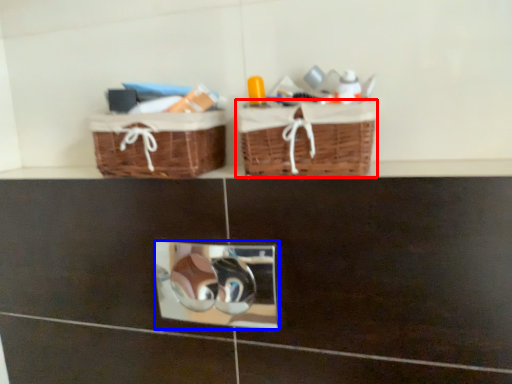
Question: Which point is further to the camera, picnic basket (highlighted by a red box) or mirror (highlighted by a blue box)?

Choices:
 (A) picnic basket
 (B) mirror

Answer: (B)